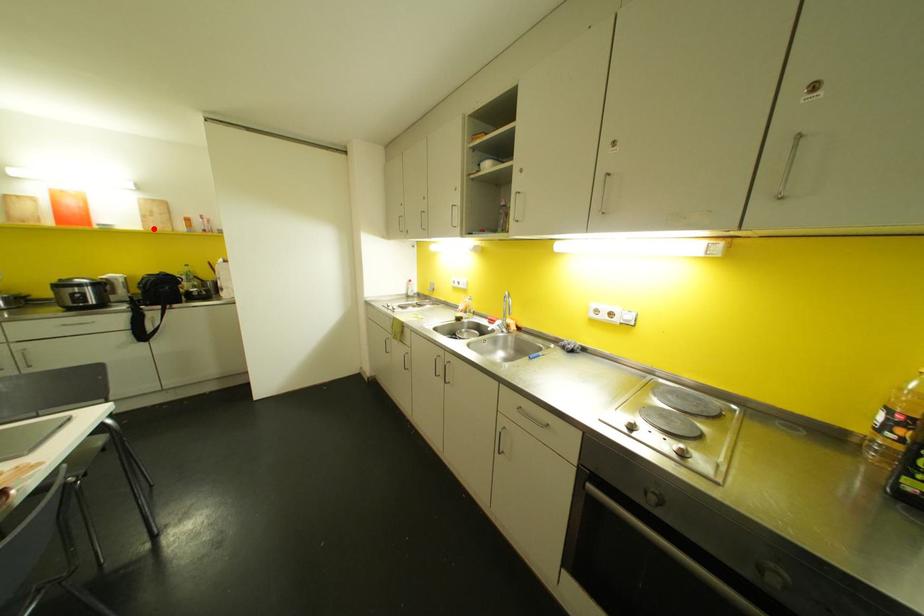
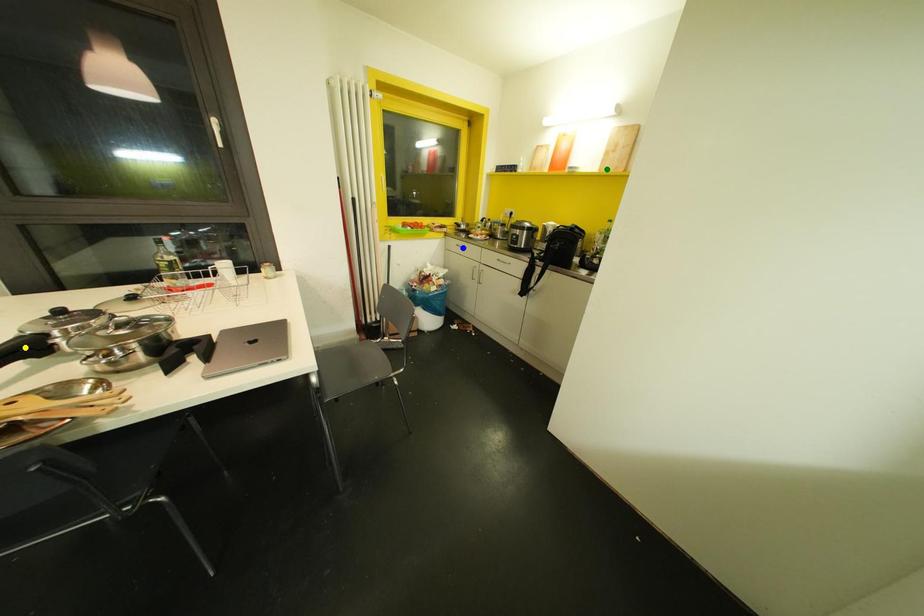
Question: I am providing you with two images of the same scene from different viewpoints. A red point is marked on the first image. You are given multiple points on the second image. Which mark in image 2 goes with the point in image 1?

Choices:
 (A) blue point
 (B) yellow point
 (C) green point

Answer: (C)